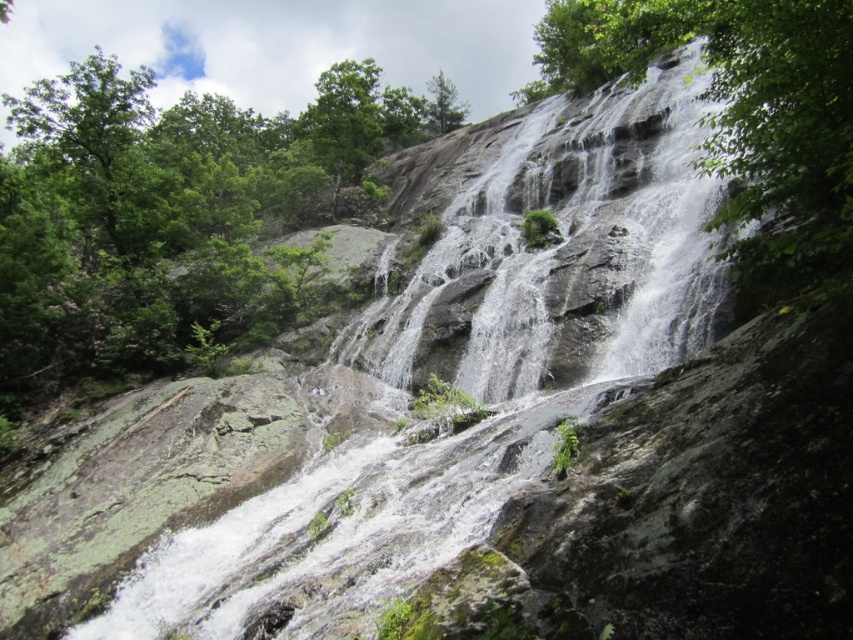
Does green leafy tree at upper right lie in front of green leafy tree at upper center?

Yes, green leafy tree at upper right is closer to the viewer.

Identify the location of green leafy tree at upper right. The image size is (853, 640). (741, 116).

At what (x,y) coordinates should I click in order to perform the action: click on gray rock waterfall at center. Please return your answer as a coordinate pair (x, y). Looking at the image, I should click on pos(567,237).

Based on the photo, is gray rock waterfall at center bigger than green leafy tree at upper right?

Actually, gray rock waterfall at center might be smaller than green leafy tree at upper right.

The image size is (853, 640). What do you see at coordinates (567, 237) in the screenshot?
I see `gray rock waterfall at center` at bounding box center [567, 237].

Locate an element on the screen. The image size is (853, 640). gray rock waterfall at center is located at coordinates click(567, 237).

Is green leafy tree at upper left taller than gray rock waterfall at center?

Indeed, green leafy tree at upper left has a greater height compared to gray rock waterfall at center.

Between point (4, 364) and point (567, 154), which one is positioned behind?

Point (567, 154)

Locate an element on the screen. green leafy tree at upper left is located at coordinates (173, 218).